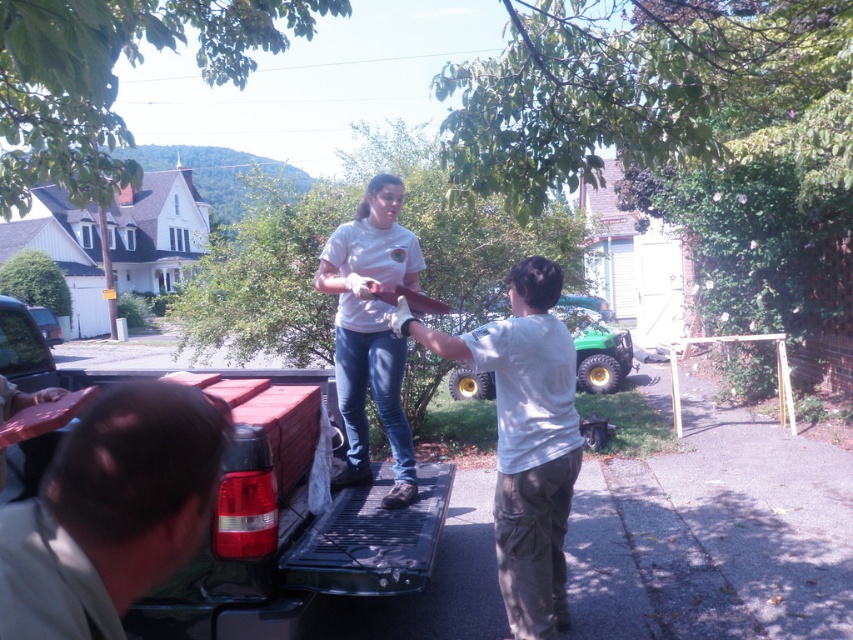
Identify the location of light brown leather jacket at lower left. Image resolution: width=853 pixels, height=640 pixels. (111, 512).

Is point (154, 448) positioned in front of point (392, 182)?

Yes, it is.

You are a GUI agent. You are given a task and a screenshot of the screen. Output one action in this format:
    pyautogui.click(x=<x>, y=<y>)
    Task: Click on the light brown leather jacket at lower left
    
    Given the screenshot: What is the action you would take?
    pyautogui.click(x=111, y=512)

You are a GUI agent. You are given a task and a screenshot of the screen. Output one action in this format:
    pyautogui.click(x=<x>, y=<y>)
    Task: Click on the light brown leather jacket at lower left
    The width and height of the screenshot is (853, 640).
    Given the screenshot: What is the action you would take?
    pyautogui.click(x=111, y=512)

Is light brown leather jacket at lower left smaller than white cotton shirt at center?

Yes.

Is point (183, 509) in front of point (442, 355)?

Yes, it is.

Locate an element on the screen. light brown leather jacket at lower left is located at coordinates (111, 512).

Find the location of a particular element. light brown leather jacket at lower left is located at coordinates (111, 512).

Can you confirm if white cotton shirt at center is shorter than white matte shirt at center?

Correct, white cotton shirt at center is not as tall as white matte shirt at center.

Measure the distance between point (x=506, y=492) and camera.

A distance of 11.11 feet exists between point (x=506, y=492) and camera.

Identify the location of white cotton shirt at center. (524, 440).